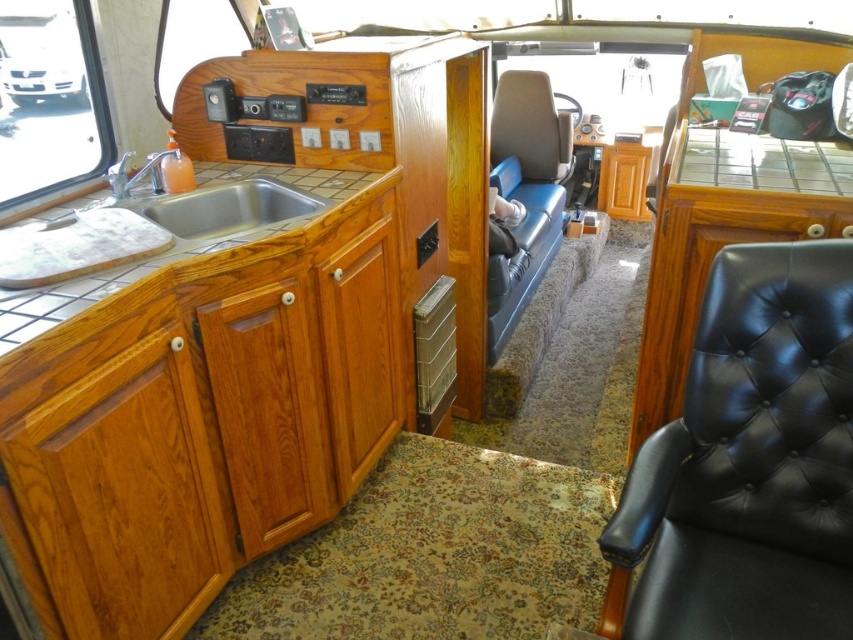
Question: Estimate the real-world distances between objects in this image. Which object is farther from the wooden drawer at center?

Choices:
 (A) black leather armchair at right
 (B) polished stainless steel sink at left

Answer: (A)

Question: Which object appears closest to the camera in this image?

Choices:
 (A) polished stainless steel sink at left
 (B) black leather armchair at right
 (C) wooden drawer at center
 (D) blue leather armchair at center

Answer: (B)

Question: Which object is the closest to the wooden drawer at center?

Choices:
 (A) polished stainless steel sink at left
 (B) blue leather armchair at center

Answer: (A)

Question: Is polished stainless steel sink at left smaller than wooden drawer at center?

Choices:
 (A) no
 (B) yes

Answer: (A)

Question: Can you confirm if blue leather armchair at center is bigger than wooden drawer at center?

Choices:
 (A) yes
 (B) no

Answer: (A)

Question: Does blue leather armchair at center have a smaller size compared to polished stainless steel sink at left?

Choices:
 (A) no
 (B) yes

Answer: (A)